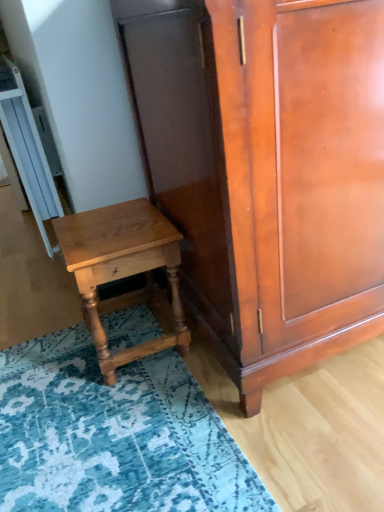
Question: From a real-world perspective, is blue textured rug at lower left located beneath light brown wood nightstand at lower left?

Choices:
 (A) no
 (B) yes

Answer: (B)

Question: Considering the relative sizes of blue textured rug at lower left and light brown wood nightstand at lower left in the image provided, is blue textured rug at lower left wider than light brown wood nightstand at lower left?

Choices:
 (A) no
 (B) yes

Answer: (B)

Question: Does blue textured rug at lower left turn towards light brown wood nightstand at lower left?

Choices:
 (A) yes
 (B) no

Answer: (B)

Question: Is blue textured rug at lower left at the left side of light brown wood nightstand at lower left?

Choices:
 (A) yes
 (B) no

Answer: (B)

Question: Is blue textured rug at lower left positioned with its back to light brown wood nightstand at lower left?

Choices:
 (A) no
 (B) yes

Answer: (A)

Question: From the image's perspective, is blue textured rug at lower left on light brown wood nightstand at lower left?

Choices:
 (A) yes
 (B) no

Answer: (B)

Question: Can you see blue textured rug at lower left touching shiny brown cabinet at center?

Choices:
 (A) yes
 (B) no

Answer: (B)

Question: Is blue textured rug at lower left at the left side of shiny brown cabinet at center?

Choices:
 (A) yes
 (B) no

Answer: (A)

Question: Considering the relative positions of blue textured rug at lower left and shiny brown cabinet at center in the image provided, is blue textured rug at lower left behind shiny brown cabinet at center?

Choices:
 (A) yes
 (B) no

Answer: (A)

Question: Is blue textured rug at lower left positioned before shiny brown cabinet at center?

Choices:
 (A) no
 (B) yes

Answer: (A)

Question: Can you confirm if blue textured rug at lower left is wider than shiny brown cabinet at center?

Choices:
 (A) no
 (B) yes

Answer: (B)

Question: Are blue textured rug at lower left and shiny brown cabinet at center located far from each other?

Choices:
 (A) no
 (B) yes

Answer: (A)

Question: Is shiny brown cabinet at center not close to light brown wood nightstand at lower left?

Choices:
 (A) yes
 (B) no

Answer: (B)